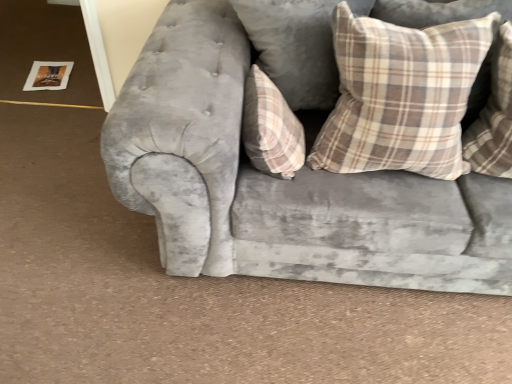
Question: Are plaid fabric pillow at upper right, which ranks as the 1th pillow in right-to-left order, and plaid fabric pillow at upper right, which ranks as the second pillow in right-to-left order, far apart?

Choices:
 (A) yes
 (B) no

Answer: (B)

Question: Is plaid fabric pillow at upper right, which is the 3th pillow in left-to-right order, with plaid fabric pillow at upper right, the second pillow when ordered from left to right?

Choices:
 (A) no
 (B) yes

Answer: (A)

Question: Can you confirm if plaid fabric pillow at upper right, which ranks as the 1th pillow in right-to-left order, is smaller than plaid fabric pillow at upper right, which ranks as the second pillow in right-to-left order?

Choices:
 (A) yes
 (B) no

Answer: (A)

Question: From a real-world perspective, is plaid fabric pillow at upper right, which is the 3th pillow in left-to-right order, physically below plaid fabric pillow at upper right, which ranks as the second pillow in right-to-left order?

Choices:
 (A) no
 (B) yes

Answer: (A)

Question: Could you tell me if plaid fabric pillow at upper right, which ranks as the 1th pillow in right-to-left order, is facing plaid fabric pillow at upper right, which ranks as the second pillow in right-to-left order?

Choices:
 (A) no
 (B) yes

Answer: (A)

Question: Can you confirm if plaid fabric pillow at upper right, which ranks as the 1th pillow in right-to-left order, is thinner than plaid fabric pillow at upper right, the second pillow when ordered from left to right?

Choices:
 (A) yes
 (B) no

Answer: (B)

Question: Is plaid fabric pillow at upper right, the second pillow when ordered from left to right, outside velvet gray couch at center?

Choices:
 (A) yes
 (B) no

Answer: (B)

Question: Is plaid fabric pillow at upper right, which ranks as the second pillow in right-to-left order, thinner than velvet gray couch at center?

Choices:
 (A) yes
 (B) no

Answer: (A)

Question: Is plaid fabric pillow at upper right, the second pillow when ordered from left to right, facing towards velvet gray couch at center?

Choices:
 (A) no
 (B) yes

Answer: (B)

Question: Does plaid fabric pillow at upper right, the second pillow when ordered from left to right, have a smaller size compared to velvet gray couch at center?

Choices:
 (A) yes
 (B) no

Answer: (A)

Question: Is plaid fabric pillow at upper right, the second pillow when ordered from left to right, beside velvet gray couch at center?

Choices:
 (A) yes
 (B) no

Answer: (B)

Question: Is plaid fabric pillow at upper right, which ranks as the second pillow in right-to-left order, far from velvet gray couch at center?

Choices:
 (A) no
 (B) yes

Answer: (A)

Question: Is velvet gray couch at center smaller than plaid fabric pillow at upper right, which is the 3th pillow in left-to-right order?

Choices:
 (A) yes
 (B) no

Answer: (B)